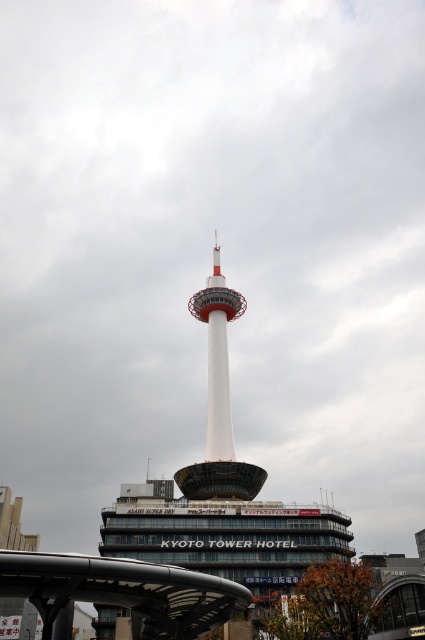
You are standing at the entrance of the Kyoto Tower Hotel and want to locate the white smooth tower at center. According to the coordinates provided, where should you look to find it?

You should look towards the coordinates point at (221, 492) to find the white smooth tower at center.

You are standing at the base of the Kyoto Tower Hotel and want to take a photo of the tower. There are two points marked on the ground where you can stand to get the best shot. The first point is at coordinates point (201, 301), and the second is at point (244, 465). According to the scene description, which point is closer to the tower?

Point (244, 465) is closer to the tower because point (201, 301) is behind it, meaning it is farther away from the tower.